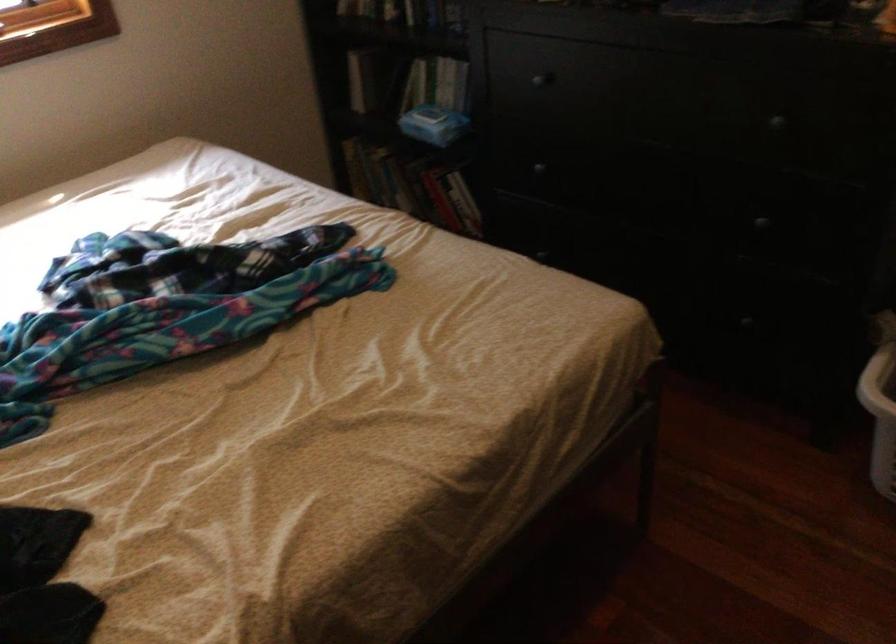
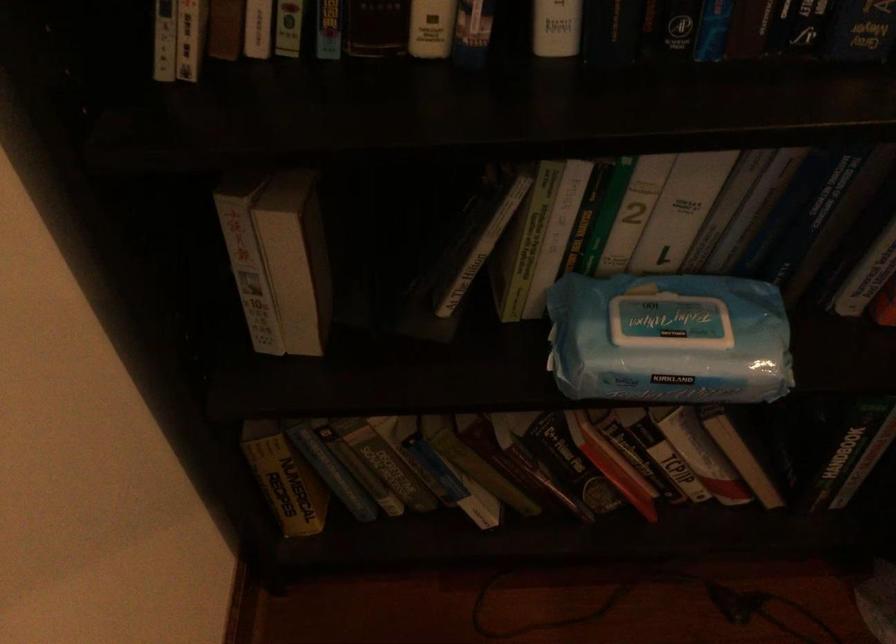
The point at (x=424, y=114) is marked in the first image. Where is the corresponding point in the second image?

(668, 339)